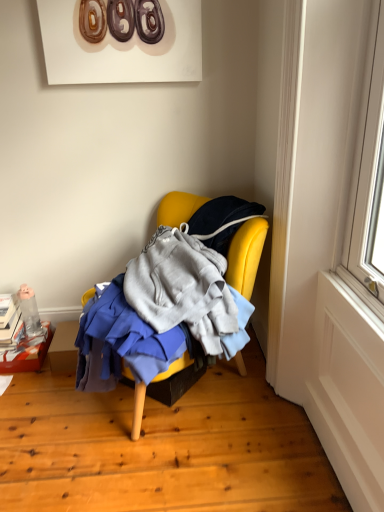
Question: Could you tell me if translucent plastic bottle at lower left is turned towards cardboard box at lower left?

Choices:
 (A) yes
 (B) no

Answer: (B)

Question: Considering the relative sizes of translucent plastic bottle at lower left and cardboard box at lower left in the image provided, is translucent plastic bottle at lower left thinner than cardboard box at lower left?

Choices:
 (A) no
 (B) yes

Answer: (B)

Question: Is cardboard box at lower left a part of translucent plastic bottle at lower left?

Choices:
 (A) yes
 (B) no

Answer: (B)

Question: Considering the relative sizes of translucent plastic bottle at lower left and cardboard box at lower left in the image provided, is translucent plastic bottle at lower left wider than cardboard box at lower left?

Choices:
 (A) yes
 (B) no

Answer: (B)

Question: From the image's perspective, is translucent plastic bottle at lower left below cardboard box at lower left?

Choices:
 (A) yes
 (B) no

Answer: (B)

Question: Does translucent plastic bottle at lower left lie behind cardboard box at lower left?

Choices:
 (A) yes
 (B) no

Answer: (A)

Question: Considering the relative sizes of translucent plastic bottle at lower left and yellow fabric chair at center in the image provided, is translucent plastic bottle at lower left bigger than yellow fabric chair at center?

Choices:
 (A) yes
 (B) no

Answer: (B)

Question: Is translucent plastic bottle at lower left at the left side of yellow fabric chair at center?

Choices:
 (A) no
 (B) yes

Answer: (B)

Question: Considering the relative sizes of translucent plastic bottle at lower left and yellow fabric chair at center in the image provided, is translucent plastic bottle at lower left shorter than yellow fabric chair at center?

Choices:
 (A) no
 (B) yes

Answer: (B)

Question: Are translucent plastic bottle at lower left and yellow fabric chair at center far apart?

Choices:
 (A) yes
 (B) no

Answer: (B)

Question: Is translucent plastic bottle at lower left located outside yellow fabric chair at center?

Choices:
 (A) no
 (B) yes

Answer: (B)

Question: Can yellow fabric chair at center be found inside translucent plastic bottle at lower left?

Choices:
 (A) no
 (B) yes

Answer: (A)

Question: Does cardboard box at lower left turn towards yellow fabric chair at center?

Choices:
 (A) yes
 (B) no

Answer: (B)